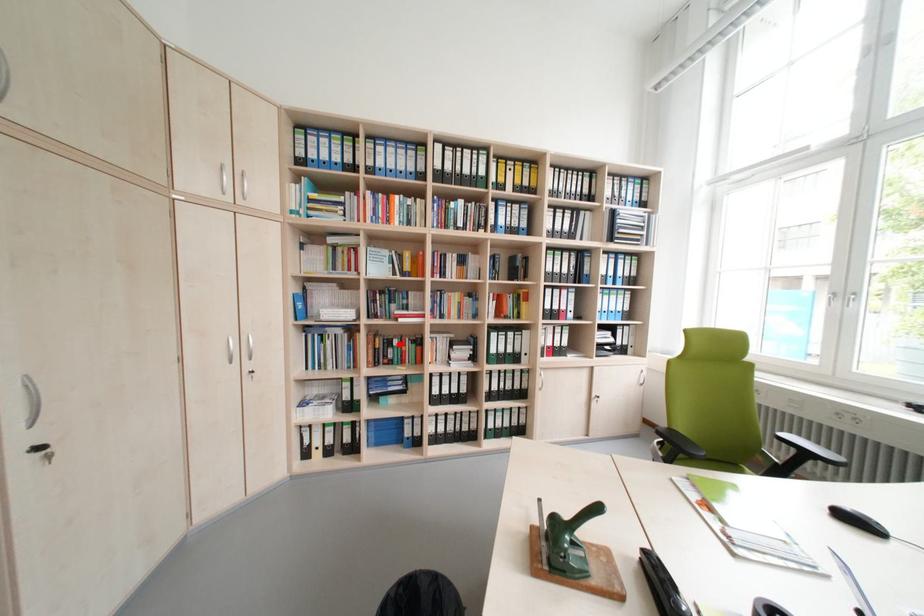
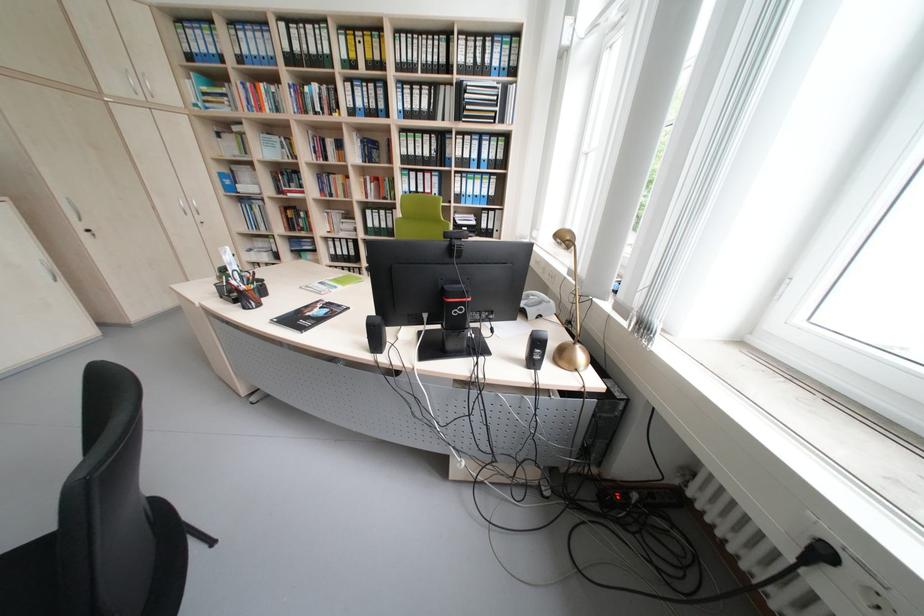
The point at the highlighted location is marked in the first image. Where is the corresponding point in the second image?

(309, 217)